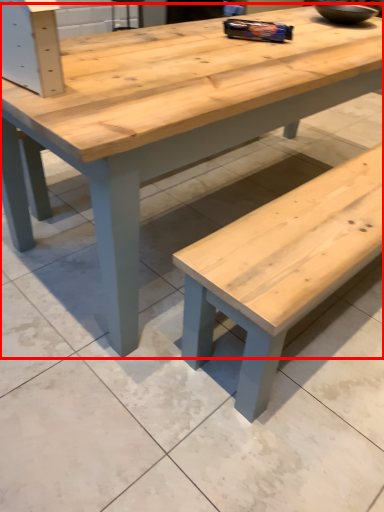
Question: From the image's perspective, what is the correct spatial positioning of table (annotated by the red box) in reference to bowl?

Choices:
 (A) below
 (B) above

Answer: (A)